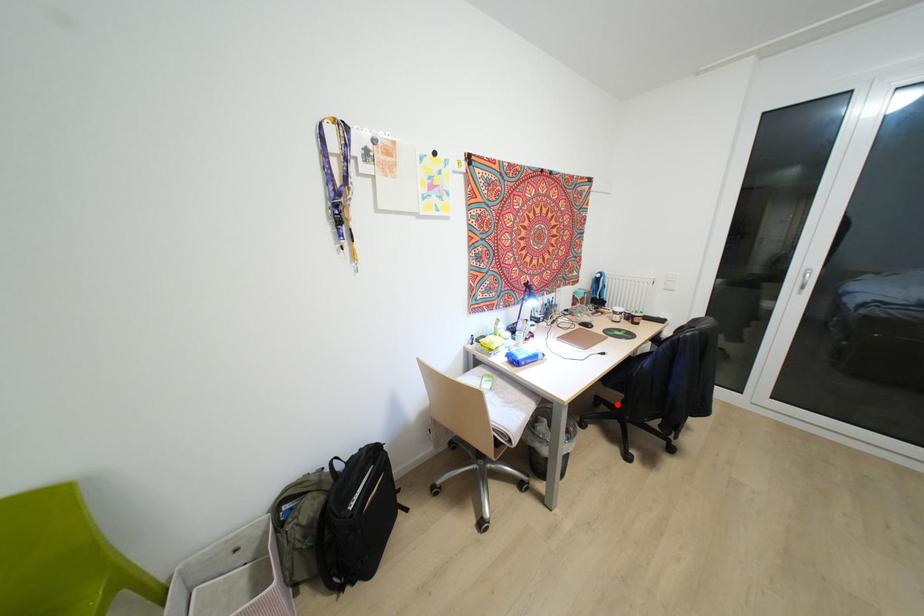
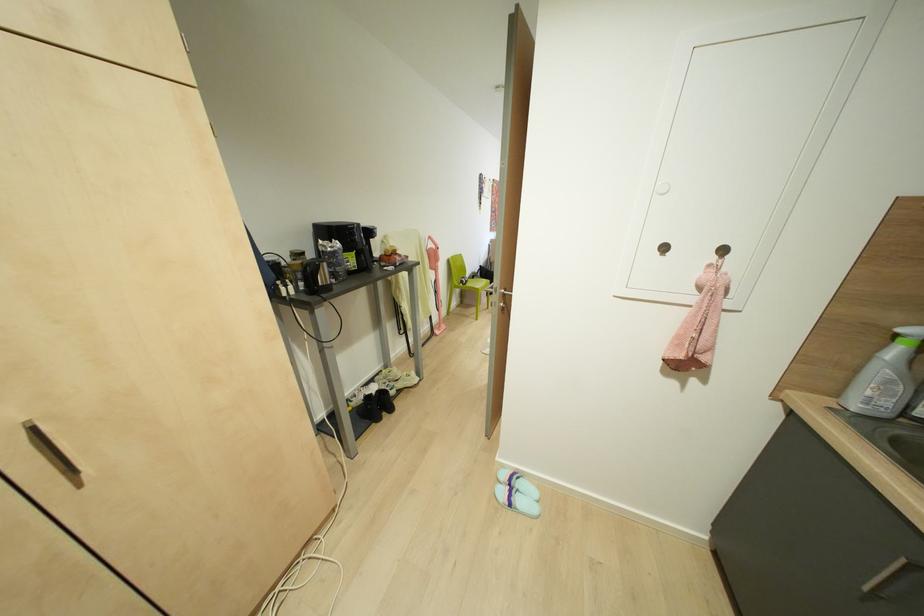
Question: I am providing you with two images of the same scene from different viewpoints. A red point is marked on the first image. Is the red point's position out of view in image 2?

Choices:
 (A) Yes
 (B) No

Answer: (A)